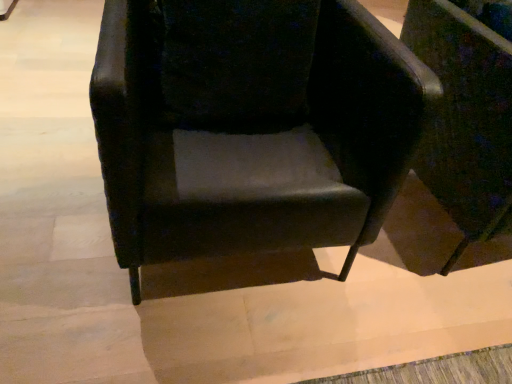
Question: Does point (308, 57) appear closer or farther from the camera than point (478, 24)?

Choices:
 (A) closer
 (B) farther

Answer: (A)

Question: From a real-world perspective, is velvet black armchair at center, marked as the 1th chair in a left-to-right arrangement, above or below matte black chair at center, the 1th chair viewed from the right?

Choices:
 (A) below
 (B) above

Answer: (B)

Question: From the image's perspective, relative to matte black chair at center, the 2th chair from the left, is velvet black armchair at center, marked as the 1th chair in a left-to-right arrangement, above or below?

Choices:
 (A) above
 (B) below

Answer: (B)

Question: Is matte black chair at center, the 2th chair from the left, taller or shorter than velvet black armchair at center, which is counted as the second chair, starting from the right?

Choices:
 (A) tall
 (B) short

Answer: (A)

Question: Is point (503, 79) closer or farther from the camera than point (338, 173)?

Choices:
 (A) farther
 (B) closer

Answer: (B)

Question: Is matte black chair at center, the 1th chair viewed from the right, spatially inside velvet black armchair at center, which is counted as the second chair, starting from the right, or outside of it?

Choices:
 (A) outside
 (B) inside

Answer: (A)

Question: From a real-world perspective, is matte black chair at center, the 1th chair viewed from the right, above or below velvet black armchair at center, which is counted as the second chair, starting from the right?

Choices:
 (A) above
 (B) below

Answer: (B)